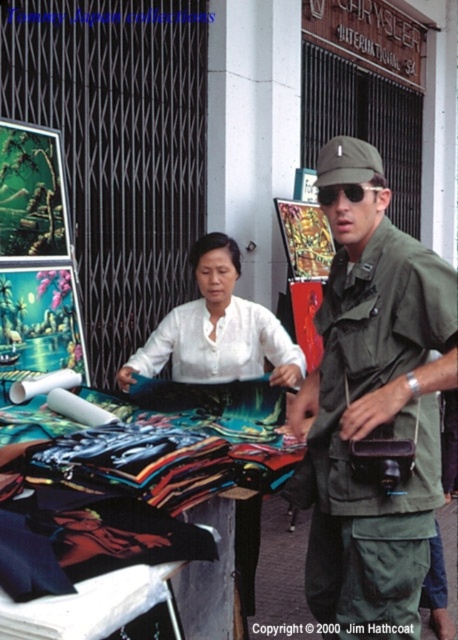
From the picture: Can you confirm if green matte uniform at center is positioned to the right of white matte shirt at center?

Indeed, green matte uniform at center is positioned on the right side of white matte shirt at center.

Measure the distance from green matte uniform at center to white matte shirt at center.

green matte uniform at center and white matte shirt at center are 35.01 inches apart.

Which is in front, point (338, 612) or point (234, 250)?

Positioned in front is point (338, 612).

The width and height of the screenshot is (458, 640). In order to click on green matte uniform at center in this screenshot , I will do `click(374, 406)`.